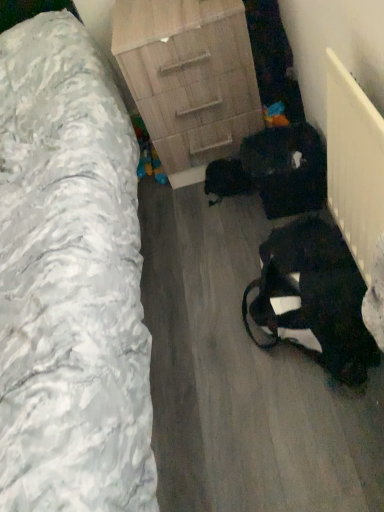
Find the location of a particular element. The height and width of the screenshot is (512, 384). free space to the left of black fabric bag at lower right is located at coordinates (204, 371).